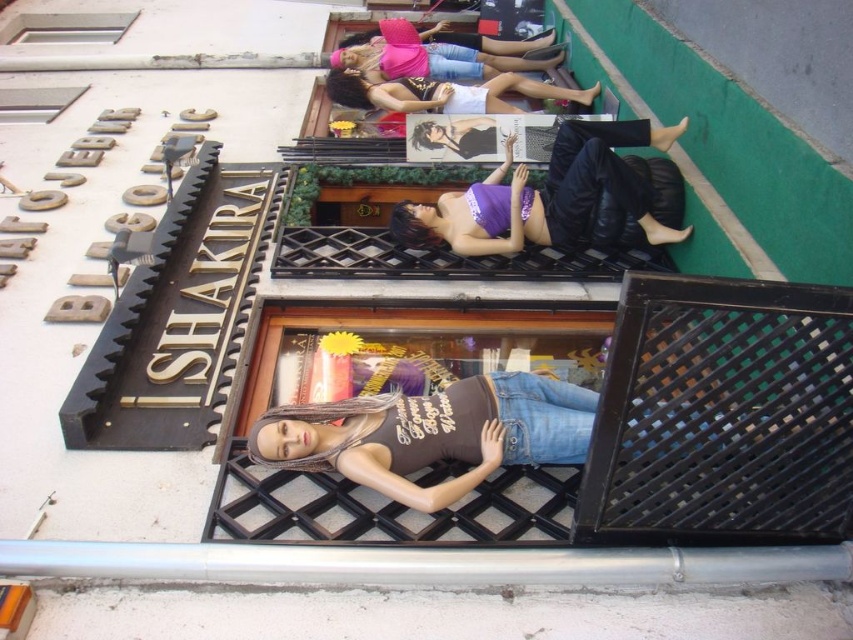
Question: From the image, what is the correct spatial relationship of pink matte tank top at upper center in relation to matte white tank top at upper center?

Choices:
 (A) right
 (B) left

Answer: (B)

Question: Where is purple satin top at center located in relation to matte white tank top at upper center in the image?

Choices:
 (A) right
 (B) left

Answer: (A)

Question: Which point appears closest to the camera in this image?

Choices:
 (A) (543, 67)
 (B) (560, 182)

Answer: (B)

Question: Among these points, which one is farthest from the camera?

Choices:
 (A) (526, 88)
 (B) (630, 122)
 (C) (486, 52)

Answer: (C)

Question: Which of the following is the closest to the observer?

Choices:
 (A) matte white tank top at upper center
 (B) purple satin top at center
 (C) pink matte tank top at upper center

Answer: (B)

Question: Does purple satin top at center have a greater width compared to matte white tank top at upper center?

Choices:
 (A) no
 (B) yes

Answer: (A)